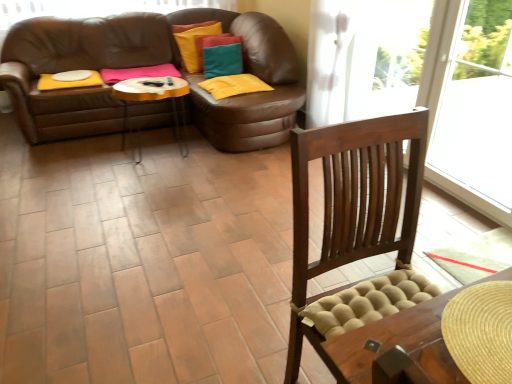
Question: From a real-world perspective, is brown leather couch at upper left above or below brown leather footrest at center?

Choices:
 (A) below
 (B) above

Answer: (A)

Question: From the image's perspective, relative to brown leather footrest at center, is brown leather couch at upper left above or below?

Choices:
 (A) above
 (B) below

Answer: (A)

Question: Based on their positions, is brown leather couch at upper left located to the left or right of brown leather footrest at center?

Choices:
 (A) left
 (B) right

Answer: (A)

Question: From a real-world perspective, is brown leather footrest at center positioned above or below brown leather couch at upper left?

Choices:
 (A) above
 (B) below

Answer: (A)

Question: From the image's perspective, is brown leather footrest at center above or below brown leather couch at upper left?

Choices:
 (A) above
 (B) below

Answer: (B)

Question: Is brown leather footrest at center inside or outside of brown leather couch at upper left?

Choices:
 (A) outside
 (B) inside

Answer: (A)

Question: Based on their sizes in the image, would you say brown leather footrest at center is bigger or smaller than brown leather couch at upper left?

Choices:
 (A) small
 (B) big

Answer: (A)